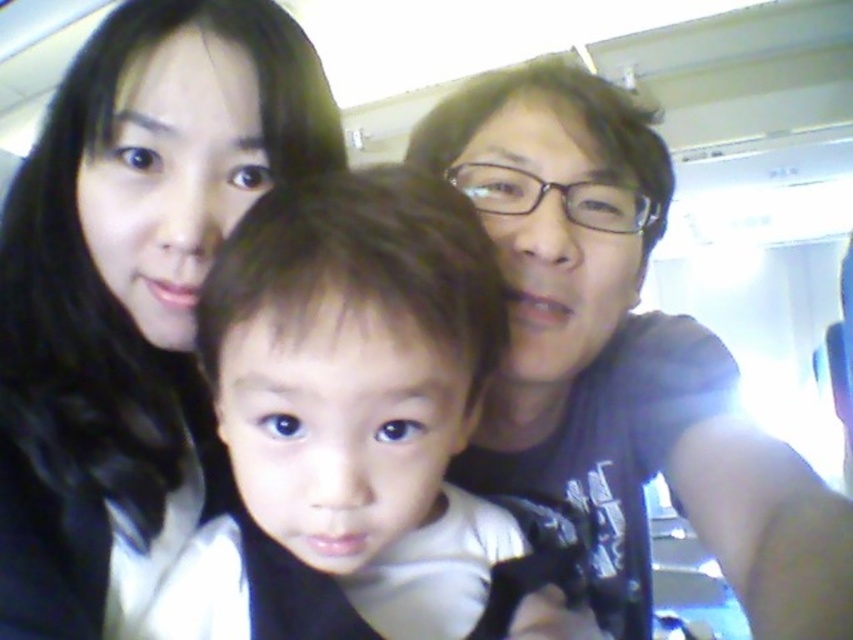
Question: Which point is farther to the camera?

Choices:
 (A) (85, 627)
 (B) (822, 595)
 (C) (445, 186)

Answer: (A)

Question: Is smooth white shirt at center behind matte black shirt at upper right?

Choices:
 (A) no
 (B) yes

Answer: (A)

Question: Which point is closer to the camera taking this photo?

Choices:
 (A) (218, 433)
 (B) (606, 582)

Answer: (A)

Question: Which of the following is the closest to the observer?

Choices:
 (A) smooth white shirt at center
 (B) black hair at upper left
 (C) matte black shirt at upper right

Answer: (A)

Question: Can you confirm if smooth white shirt at center is thinner than matte black shirt at upper right?

Choices:
 (A) yes
 (B) no

Answer: (A)

Question: Can you confirm if black hair at upper left is thinner than smooth white shirt at center?

Choices:
 (A) no
 (B) yes

Answer: (B)